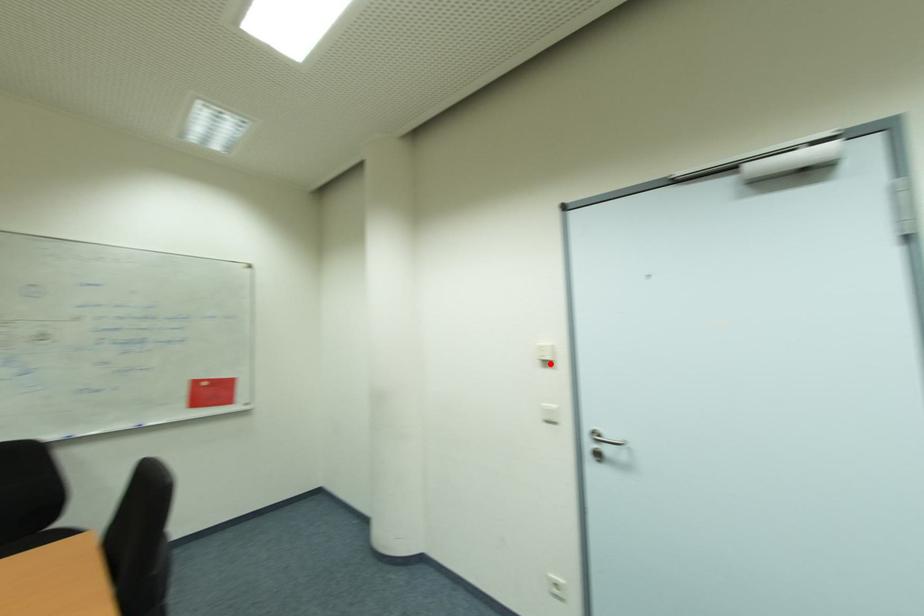
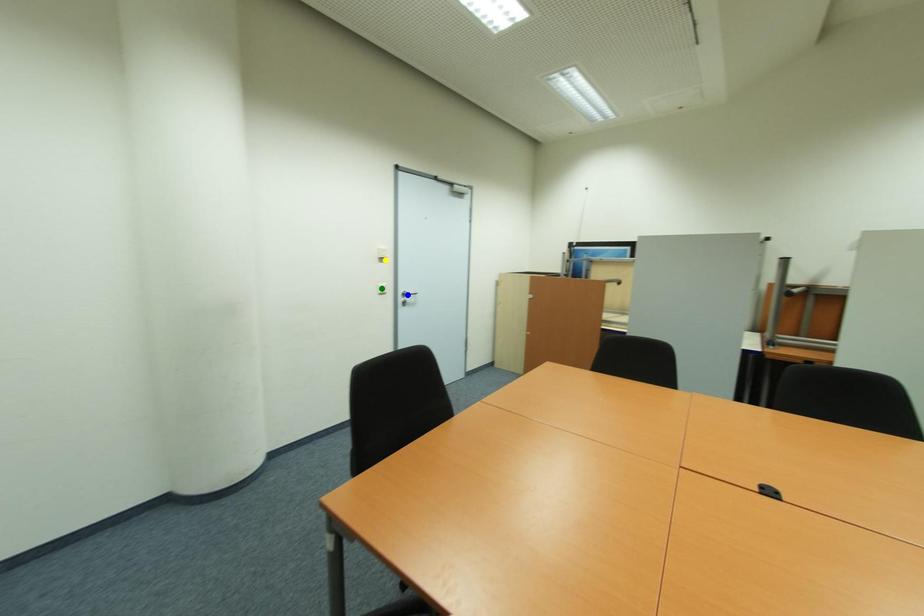
Question: I am providing you with two images of the same scene from different viewpoints. A red point is marked on the first image. You are given multiple points on the second image. Which point in image 2 is actually the same real-world point as the red point in image 1?

Choices:
 (A) yellow point
 (B) blue point
 (C) green point

Answer: (A)